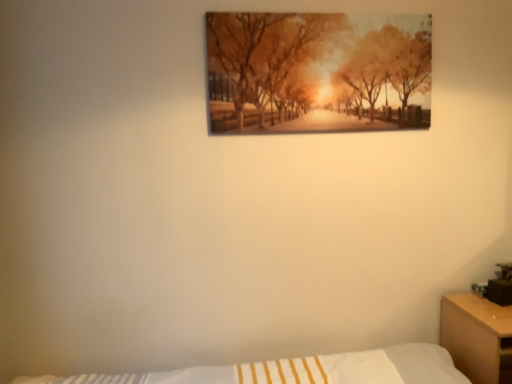
Question: Is matte black table lamp at right completely or partially outside of wooden nightstand at right?

Choices:
 (A) no
 (B) yes

Answer: (B)

Question: Is matte black table lamp at right positioned behind wooden nightstand at right?

Choices:
 (A) no
 (B) yes

Answer: (B)

Question: From the image's perspective, does matte black table lamp at right appear lower than wooden nightstand at right?

Choices:
 (A) no
 (B) yes

Answer: (A)

Question: Considering the relative sizes of matte black table lamp at right and wooden nightstand at right in the image provided, is matte black table lamp at right taller than wooden nightstand at right?

Choices:
 (A) yes
 (B) no

Answer: (B)

Question: From a real-world perspective, is matte black table lamp at right on wooden nightstand at right?

Choices:
 (A) yes
 (B) no

Answer: (A)

Question: In terms of width, does wooden nightstand at right look wider or thinner when compared to matte black table lamp at right?

Choices:
 (A) wide
 (B) thin

Answer: (A)

Question: From the image's perspective, relative to matte black table lamp at right, is wooden nightstand at right above or below?

Choices:
 (A) above
 (B) below

Answer: (B)

Question: In terms of height, does wooden nightstand at right look taller or shorter compared to matte black table lamp at right?

Choices:
 (A) tall
 (B) short

Answer: (A)

Question: Considering the positions of point (484, 336) and point (500, 299), is point (484, 336) closer or farther from the camera than point (500, 299)?

Choices:
 (A) farther
 (B) closer

Answer: (B)

Question: Relative to matte black table lamp at right, is matte wooden picture frame at upper center in front or behind?

Choices:
 (A) front
 (B) behind

Answer: (A)

Question: Is matte wooden picture frame at upper center bigger or smaller than matte black table lamp at right?

Choices:
 (A) big
 (B) small

Answer: (A)

Question: Which is correct: matte wooden picture frame at upper center is inside matte black table lamp at right, or outside of it?

Choices:
 (A) outside
 (B) inside

Answer: (A)

Question: From the image's perspective, is matte wooden picture frame at upper center located above or below matte black table lamp at right?

Choices:
 (A) above
 (B) below

Answer: (A)

Question: Visually, is wooden nightstand at right positioned to the left or to the right of matte wooden picture frame at upper center?

Choices:
 (A) right
 (B) left

Answer: (A)

Question: Is wooden nightstand at right taller or shorter than matte wooden picture frame at upper center?

Choices:
 (A) short
 (B) tall

Answer: (A)